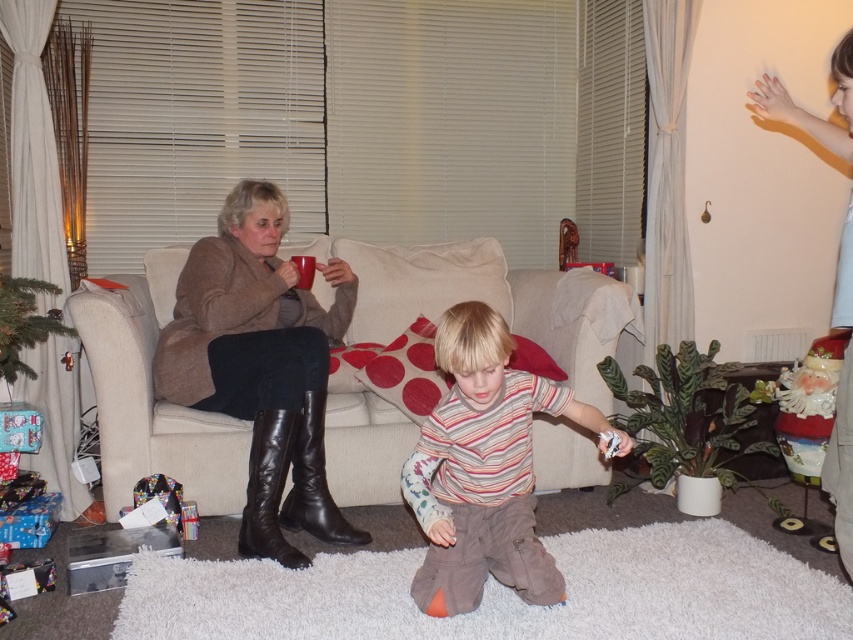
Question: Among these points, which one is farthest from the camera?

Choices:
 (A) (260, 445)
 (B) (283, 518)
 (C) (245, 326)
 (D) (686, 385)

Answer: (D)

Question: Observing the image, what is the correct spatial positioning of beige fabric couch at center in reference to striped cotton shirt at center?

Choices:
 (A) left
 (B) right

Answer: (A)

Question: Is green matte plant at lower center to the right of black leather boot at lower left from the viewer's perspective?

Choices:
 (A) no
 (B) yes

Answer: (B)

Question: Is the position of brown leather boots at left less distant than that of green matte plant at lower center?

Choices:
 (A) yes
 (B) no

Answer: (A)

Question: Which object is the farthest from the brown leather boots at left?

Choices:
 (A) green matte plant at lower center
 (B) leather boots at left
 (C) beige fabric couch at center
 (D) black leather boot at lower left

Answer: (A)

Question: Which point appears farthest from the camera in this image?

Choices:
 (A) (254, 516)
 (B) (642, 413)
 (C) (111, 390)

Answer: (B)